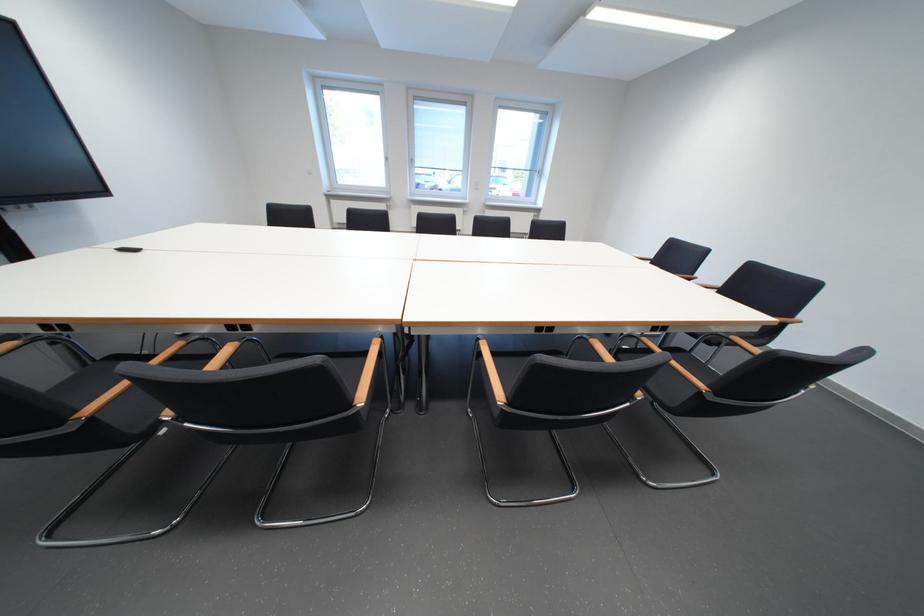
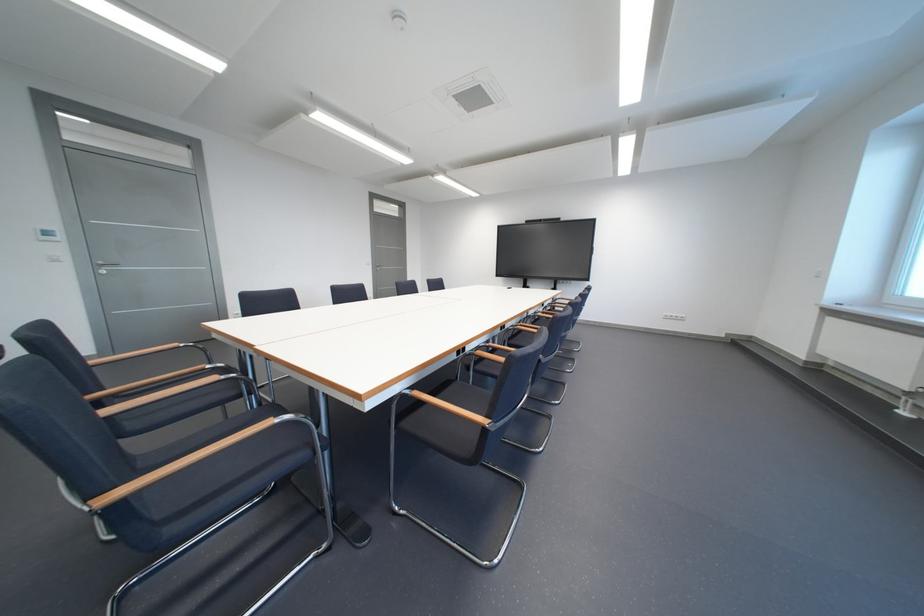
Question: I am providing you with two images of the same scene from different viewpoints. After the viewpoint changes to image2, which objects are now occluded?

Choices:
 (A) wooden chair armrest
 (B) white light switch
 (C) black zipper pouch
 (D) silver door handle

Answer: (A)